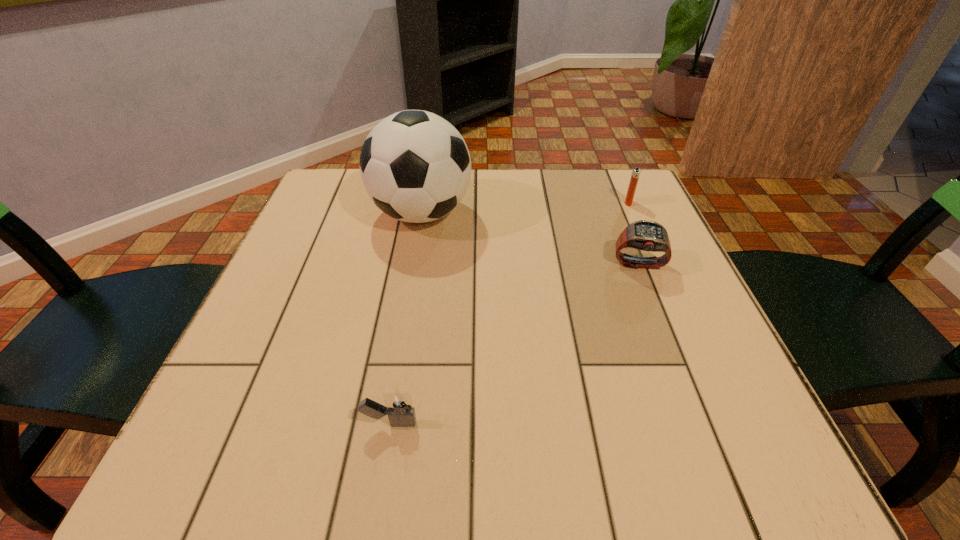
At what (x,y) coordinates should I click in order to perform the action: click on vacant space at the right edge. Please return your answer as a coordinate pair (x, y). Looking at the image, I should click on (672, 298).

Where is `vacant space at the far left corner`? The height and width of the screenshot is (540, 960). vacant space at the far left corner is located at coordinates (358, 174).

Locate an element on the screen. vacant region at the near left corner of the desktop is located at coordinates (241, 481).

Locate an element on the screen. vacant space at the far right corner is located at coordinates (590, 197).

Locate an element on the screen. The image size is (960, 540). unoccupied area between the soccer ball and the nearest object is located at coordinates (406, 318).

Find the location of a particular element. The width and height of the screenshot is (960, 540). vacant area that lies between the nearer igniter and the farther igniter is located at coordinates (509, 313).

Identify the location of free area in between the tallest object and the nearest object. The height and width of the screenshot is (540, 960). (406, 318).

Locate an element on the screen. The width and height of the screenshot is (960, 540). empty location between the tallest object and the left igniter is located at coordinates (406, 318).

You are a GUI agent. You are given a task and a screenshot of the screen. Output one action in this format:
    pyautogui.click(x=<x>, y=<y>)
    Task: Click on the vacant space that is in between the second nearest object and the nearest object
    The height and width of the screenshot is (540, 960).
    Given the screenshot: What is the action you would take?
    pyautogui.click(x=515, y=344)

This screenshot has height=540, width=960. I want to click on empty location between the shorter igniter and the soccer ball, so click(406, 318).